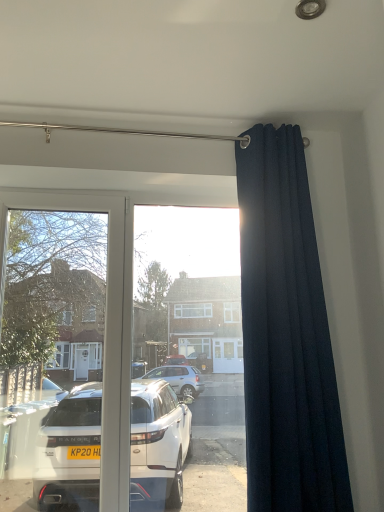
Question: Should I look upward or downward to see dark blue fabric curtain at right?

Choices:
 (A) down
 (B) up

Answer: (A)